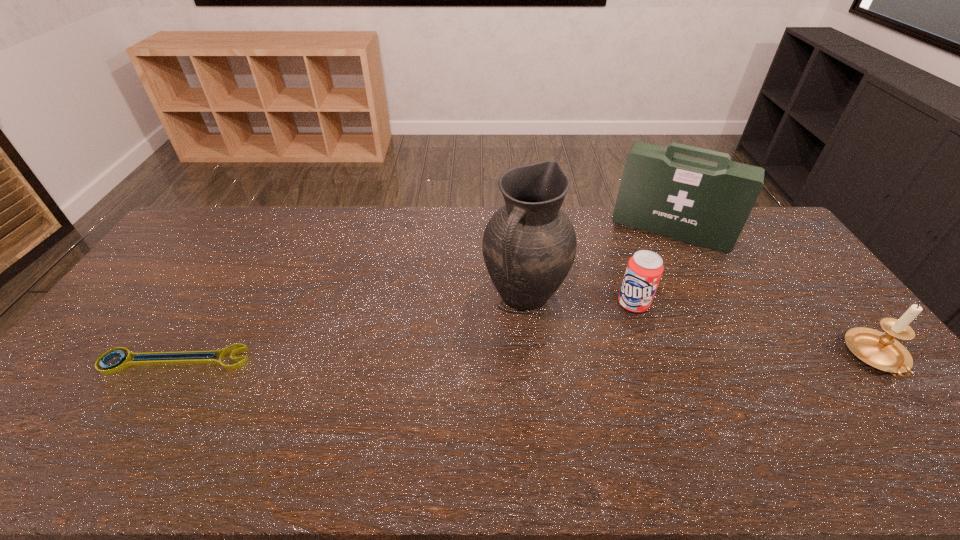
This screenshot has height=540, width=960. Find the location of `object that is positioned at the left edge`. object that is positioned at the left edge is located at coordinates (199, 357).

Where is `object present at the right edge`? This screenshot has width=960, height=540. object present at the right edge is located at coordinates point(877,349).

In the image, there is a desktop. At what (x,y) coordinates should I click in order to perform the action: click on vacant space at the far edge. Please return your answer as a coordinate pair (x, y). Looking at the image, I should click on (364, 230).

Where is `vacant space at the near edge of the desktop`? This screenshot has height=540, width=960. vacant space at the near edge of the desktop is located at coordinates (844, 403).

This screenshot has width=960, height=540. I want to click on vacant space at the right edge of the desktop, so click(x=885, y=383).

At what (x,y) coordinates should I click in order to perform the action: click on vacant area between the candle holder and the farthest object. Please return your answer as a coordinate pair (x, y). This screenshot has width=960, height=540. Looking at the image, I should click on (774, 294).

This screenshot has height=540, width=960. In order to click on empty location between the pitcher and the soda can in this screenshot , I will do `click(579, 299)`.

The width and height of the screenshot is (960, 540). Find the location of `vacant area between the first-aid kit and the leftmost object`. vacant area between the first-aid kit and the leftmost object is located at coordinates (423, 295).

You are a GUI agent. You are given a task and a screenshot of the screen. Output one action in this format:
    pyautogui.click(x=<x>, y=<y>)
    Task: Click on the free spot between the soda can and the candle holder
    This screenshot has width=960, height=540.
    Given the screenshot: What is the action you would take?
    pyautogui.click(x=756, y=330)

Image resolution: width=960 pixels, height=540 pixels. Identify the location of free spot between the soda can and the pitcher. (579, 299).